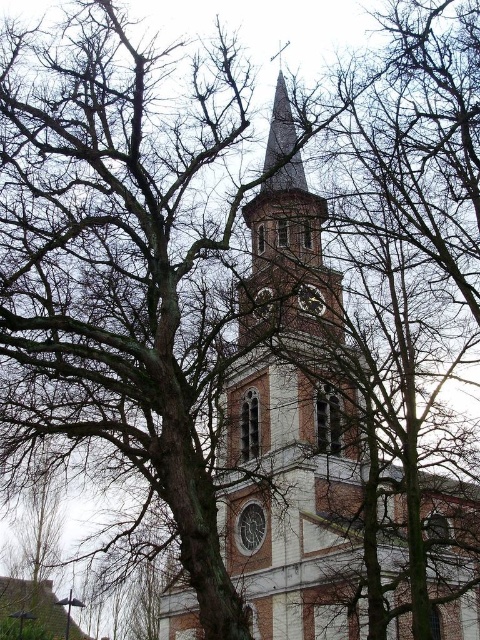
You are standing in front of the church and want to take a photo of the metallic silver clock at center. Where should you aim your camera to capture it?

You should aim your camera at the point with coordinates 0.469 on the x axis and 0.648 on the y axis to capture the metallic silver clock at center.

You are a maintenance worker who needs to reach both the metallic silver clock at center and the metallic clock at center. Which clock is closer to you?

Both the metallic silver clock at center and the metallic clock at center are the same object, so there is no distance between them. You only need to reach one clock.